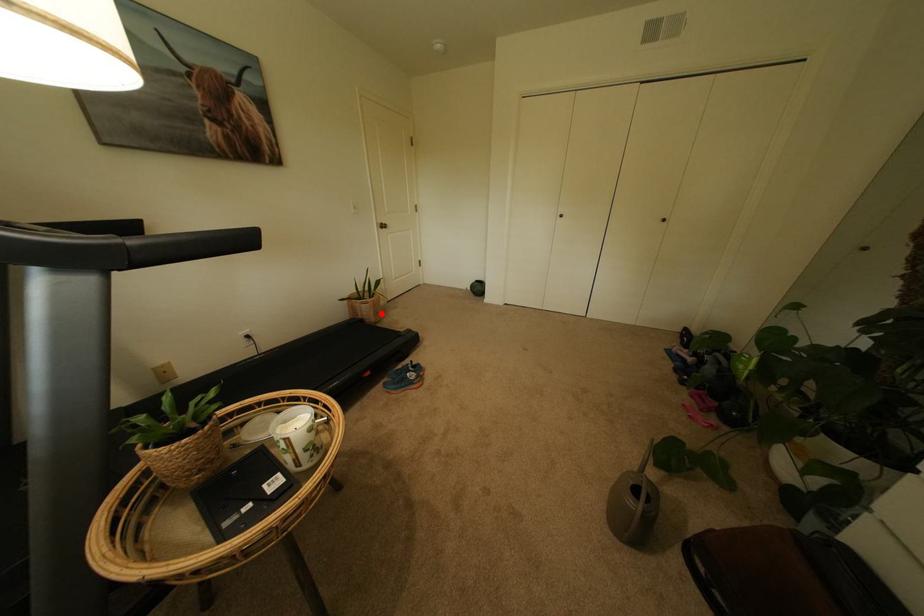
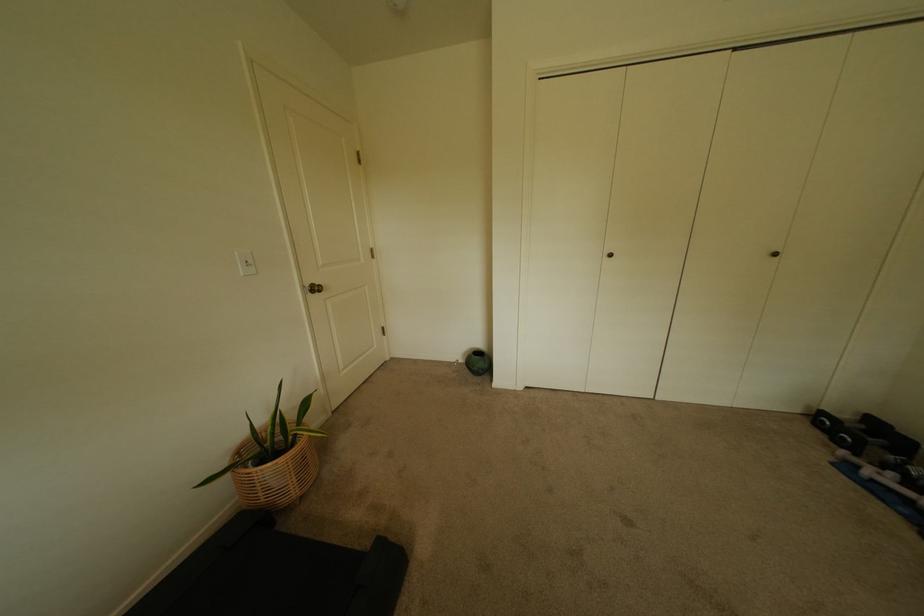
Question: I am providing you with two images of the same scene from different viewpoints. A red point is shown in image1. For the corresponding object point in image2, is it positioned nearer or farther from the camera?

Choices:
 (A) Nearer
 (B) Farther

Answer: (B)